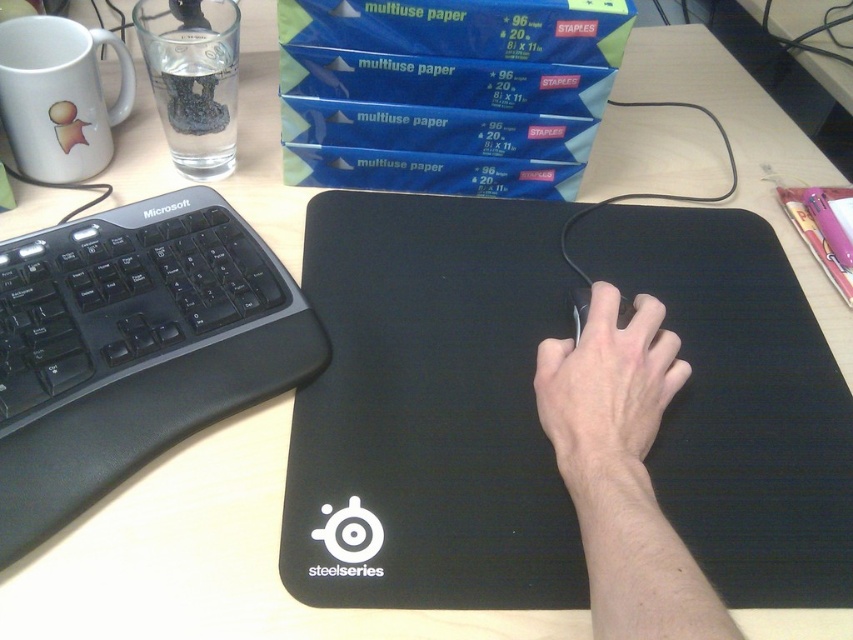
Question: Does black matte keyboard at left have a larger size compared to skinny white hand at center?

Choices:
 (A) no
 (B) yes

Answer: (B)

Question: Can you confirm if black rubber mousepad at center is positioned to the right of black matte keyboard at left?

Choices:
 (A) yes
 (B) no

Answer: (A)

Question: Estimate the real-world distances between objects in this image. Which object is farther from the black rubber mousepad at center?

Choices:
 (A) matte black mouse at center
 (B) black matte mouse at center
 (C) black matte keyboard at left

Answer: (C)

Question: Does black matte keyboard at left appear under black matte mouse at center?

Choices:
 (A) no
 (B) yes

Answer: (B)

Question: Considering the real-world distances, which object is closest to the skinny white hand at center?

Choices:
 (A) matte black mouse at center
 (B) black matte mouse at center
 (C) black rubber mousepad at center

Answer: (A)

Question: Which of the following is the farthest from the observer?

Choices:
 (A) black rubber mousepad at center
 (B) matte black mouse at center
 (C) black matte mouse at center
 (D) black matte keyboard at left

Answer: (C)